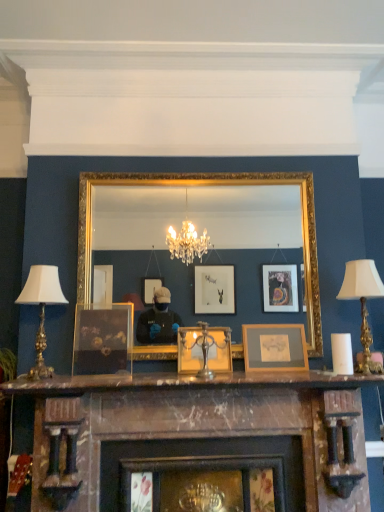
The image size is (384, 512). What are the coordinates of `free point above gold-framed mirror at center (from a real-world perspective)` in the screenshot? It's located at [x=194, y=169].